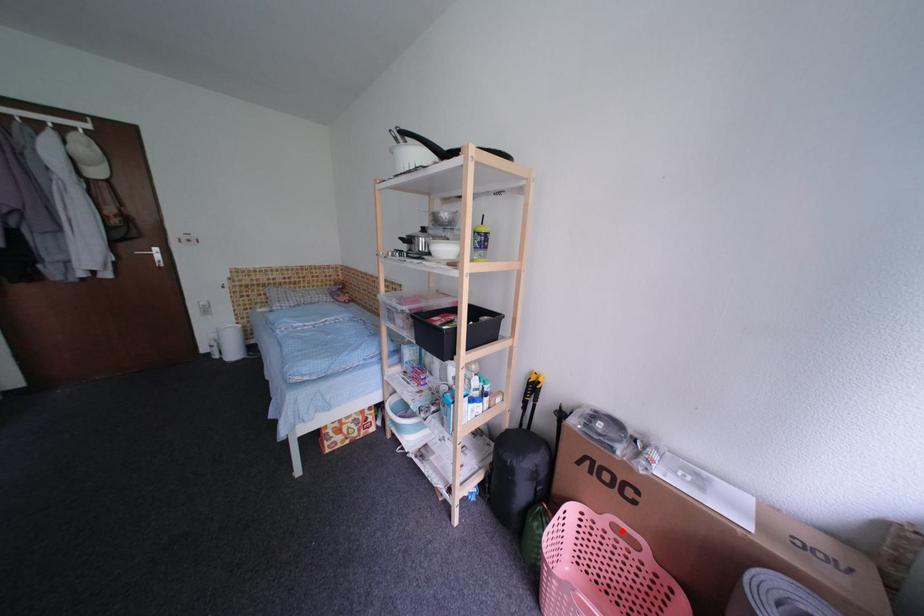
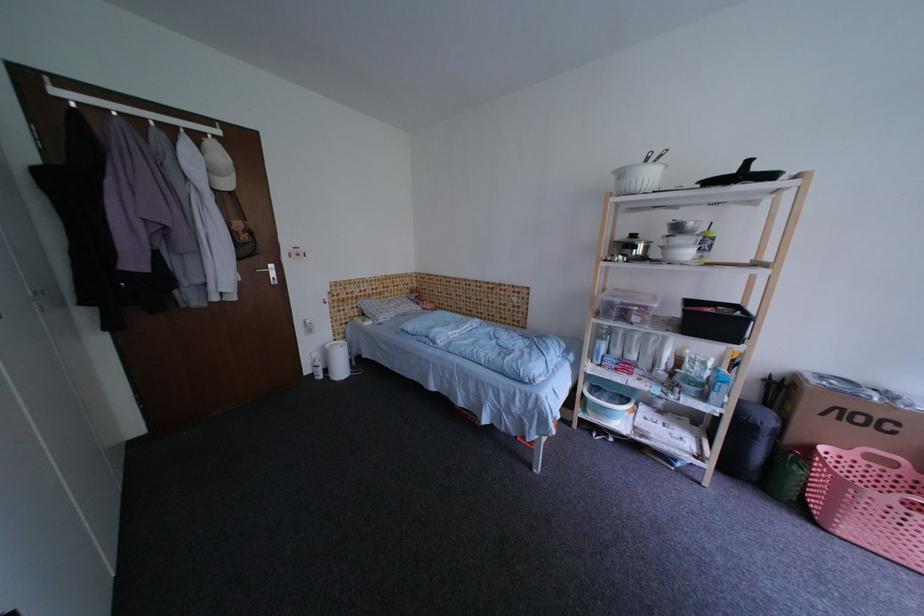
In the second image, find the point that corresponds to the highlighted location in the first image.

(878, 459)